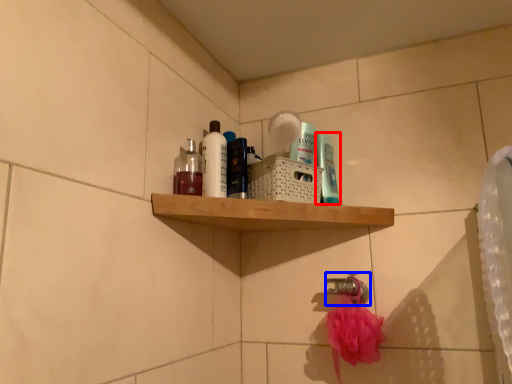
Question: Which object appears farthest to the camera in this image, mouthwash (highlighted by a red box) or faucet (highlighted by a blue box)?

Choices:
 (A) mouthwash
 (B) faucet

Answer: (B)